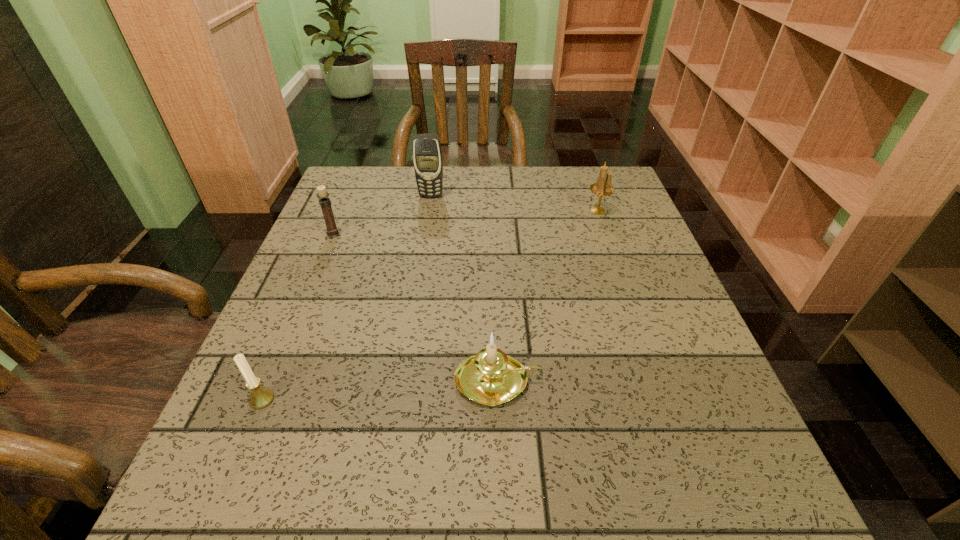
Locate an element on the screen. This screenshot has height=540, width=960. the third object from right to left is located at coordinates (427, 156).

Identify the location of the farthest object. This screenshot has width=960, height=540. (427, 156).

The image size is (960, 540). Find the location of `the second farthest object`. the second farthest object is located at coordinates (603, 187).

Where is `the rightmost object`? The image size is (960, 540). the rightmost object is located at coordinates (603, 187).

Find the location of a particular element. This screenshot has width=960, height=540. the third nearest candle holder is located at coordinates (322, 195).

The image size is (960, 540). Find the location of `the fourth object from left to right`. the fourth object from left to right is located at coordinates (490, 377).

The width and height of the screenshot is (960, 540). In order to click on free space located 0.130m on the front face of the cellular telephone in this screenshot , I will do `click(426, 227)`.

I want to click on free point located on the left of the rightmost candle holder, so click(499, 211).

Image resolution: width=960 pixels, height=540 pixels. In order to click on free location located 0.240m on the back of the third farthest object in this screenshot , I will do `click(355, 181)`.

This screenshot has height=540, width=960. I want to click on vacant space located 0.080m on the handle side of the third candle holder from left to right, so click(585, 381).